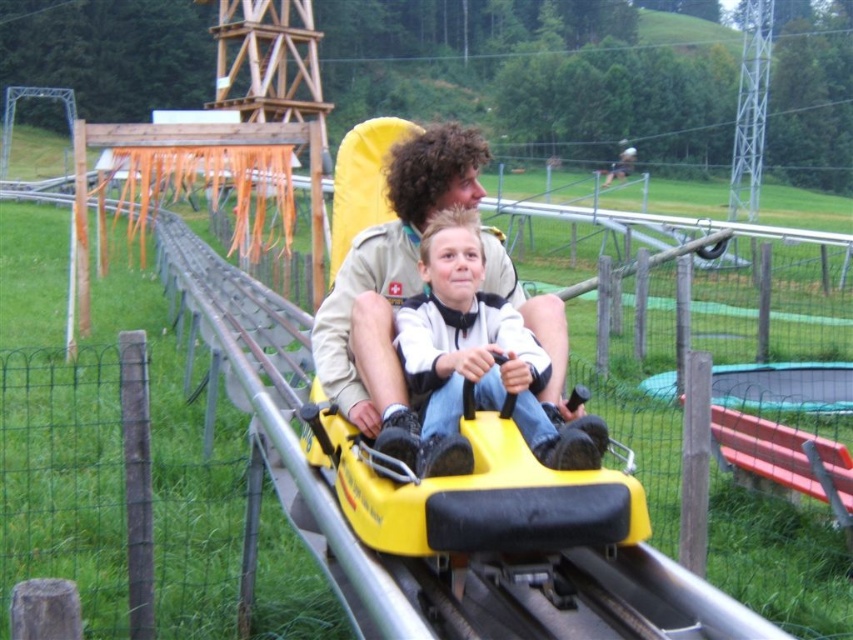
Question: Among these objects, which one is nearest to the camera?

Choices:
 (A) matte yellow helmet at center
 (B) khaki uniform at center

Answer: (A)

Question: Is khaki uniform at center thinner than matte yellow helmet at center?

Choices:
 (A) no
 (B) yes

Answer: (A)

Question: Which object appears closest to the camera in this image?

Choices:
 (A) matte yellow helmet at center
 (B) khaki uniform at center

Answer: (A)

Question: Considering the relative positions of khaki uniform at center and matte yellow helmet at center in the image provided, where is khaki uniform at center located with respect to matte yellow helmet at center?

Choices:
 (A) above
 (B) below

Answer: (A)

Question: In this image, where is khaki uniform at center located relative to matte yellow helmet at center?

Choices:
 (A) left
 (B) right

Answer: (A)